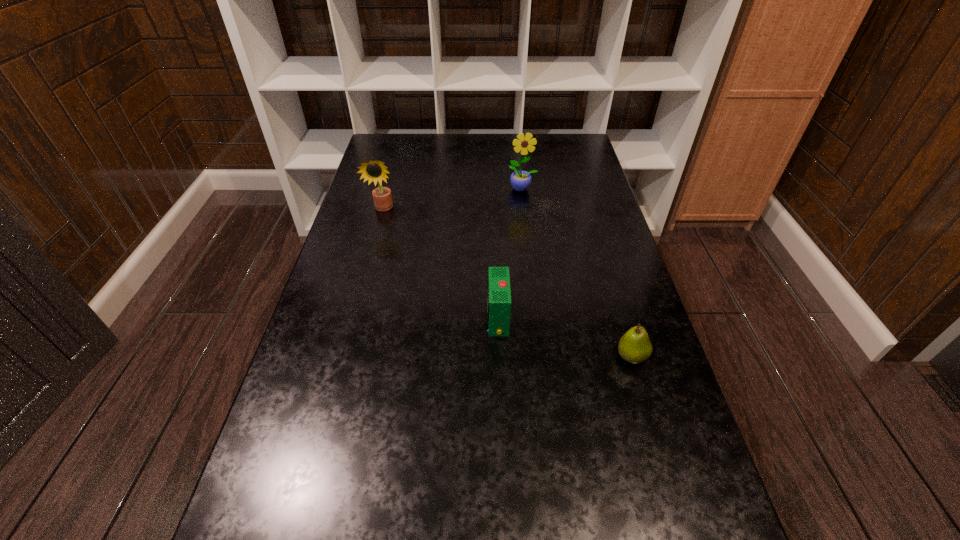
This screenshot has width=960, height=540. I want to click on the farthest object, so click(x=520, y=180).

Where is `the second object from right to left`? The image size is (960, 540). the second object from right to left is located at coordinates (520, 180).

In order to click on the leftmost object in this screenshot , I will do `click(375, 171)`.

You are a GUI agent. You are given a task and a screenshot of the screen. Output one action in this format:
    pyautogui.click(x=<x>, y=<y>)
    Task: Click on the left sunflower
    The height and width of the screenshot is (540, 960).
    Given the screenshot: What is the action you would take?
    pyautogui.click(x=375, y=171)

Locate an element on the screen. The width and height of the screenshot is (960, 540). the second shortest object is located at coordinates pyautogui.click(x=498, y=284).

Identify the location of the second nearest object. (498, 284).

At what (x,y) coordinates should I click in order to perform the action: click on the shortest object. Please return your answer as a coordinate pair (x, y). Looking at the image, I should click on (634, 346).

This screenshot has height=540, width=960. Find the location of `the rightmost object`. the rightmost object is located at coordinates (634, 346).

The image size is (960, 540). In order to click on vacant space located on the front-facing side of the farther sunflower in this screenshot , I will do `click(531, 260)`.

I want to click on free location located 0.260m on the face of the leftmost object, so click(366, 275).